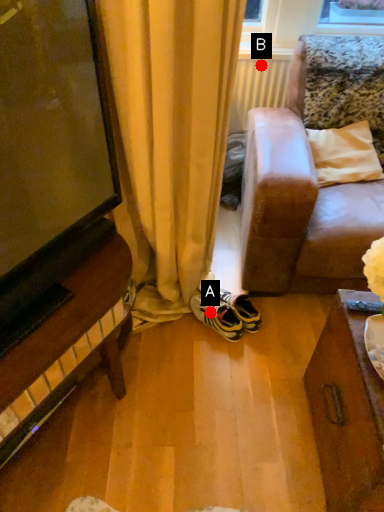
Question: Two points are circled on the image, labeled by A and B beside each circle. Which point appears farthest from the camera in this image?

Choices:
 (A) A is further
 (B) B is further

Answer: (B)